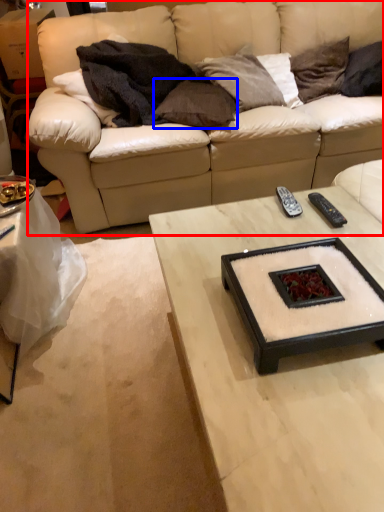
Question: Among these objects, which one is farthest to the camera, studio couch (highlighted by a red box) or pillow (highlighted by a blue box)?

Choices:
 (A) studio couch
 (B) pillow

Answer: (B)